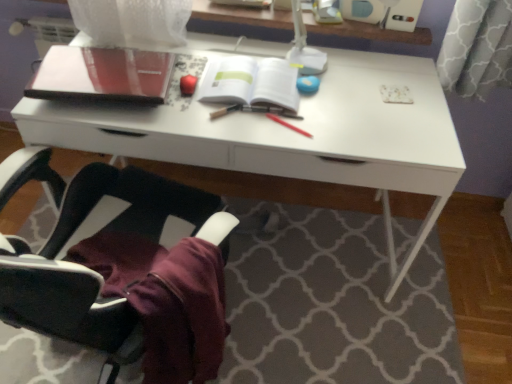
This screenshot has width=512, height=384. Find the location of `free location to the left of red matte pen at center, positioned as the 3th stationery in left-to-right order`. free location to the left of red matte pen at center, positioned as the 3th stationery in left-to-right order is located at coordinates (242, 125).